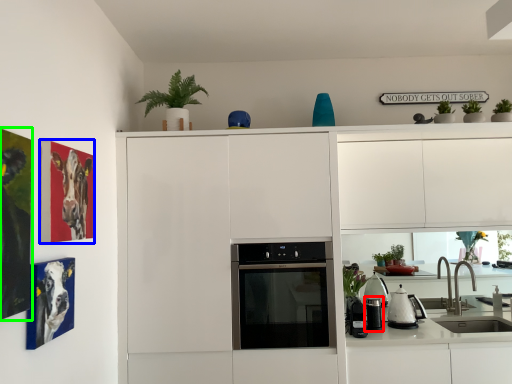
Question: Considering the real-world distances, which object is farthest from appliance (highlighted by a red box)? picture frame (highlighted by a blue box) or picture frame (highlighted by a green box)?

Choices:
 (A) picture frame
 (B) picture frame

Answer: (B)